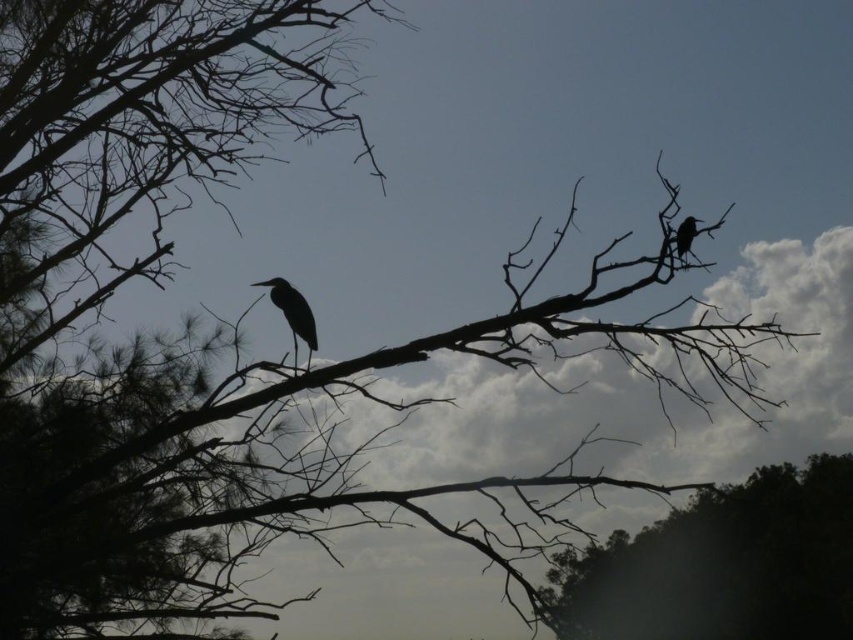
Question: Which point is farther to the camera?

Choices:
 (A) matte black bird at upper right
 (B) dark brown bark tree at lower right

Answer: (A)

Question: Considering the real-world distances, which object is farthest from the matte black bird at upper right?

Choices:
 (A) matte black bird at center
 (B) dark brown bark tree at lower right

Answer: (B)

Question: In this image, where is dark brown bark tree at lower right located relative to matte black bird at upper right?

Choices:
 (A) below
 (B) above

Answer: (A)

Question: Is dark brown bark tree at lower right to the left of matte black bird at center from the viewer's perspective?

Choices:
 (A) no
 (B) yes

Answer: (A)

Question: Which point appears farthest from the camera in this image?

Choices:
 (A) (688, 243)
 (B) (663, 628)

Answer: (B)

Question: Can you confirm if dark brown bark tree at lower right is wider than matte black bird at upper right?

Choices:
 (A) yes
 (B) no

Answer: (A)